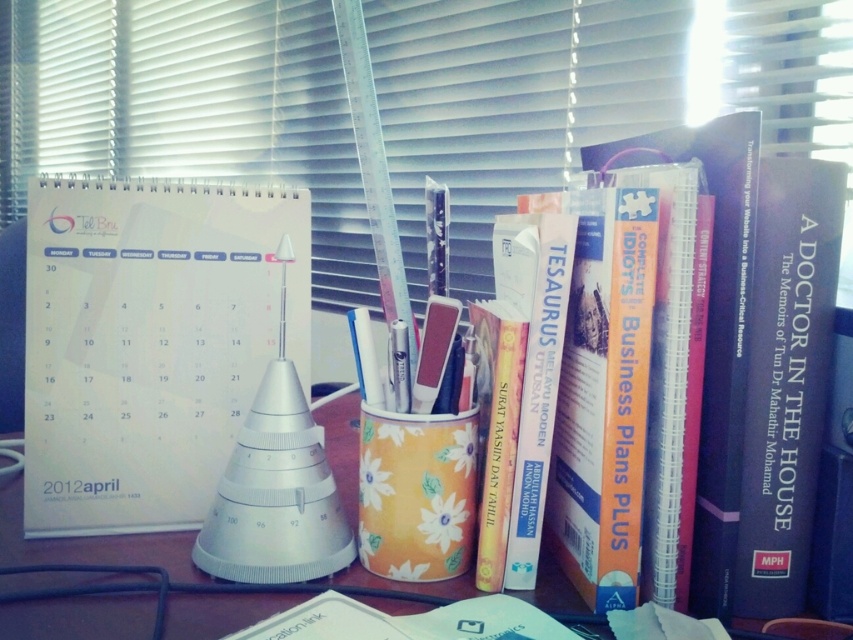
You are organizing your desk and need to place a new item between the white plastic ruler at upper center and the blue hardcover book at right. What is the minimum distance you should maintain between them to ensure the new item fits comfortably?

The white plastic ruler at upper center is 4.54 feet from the blue hardcover book at right. To fit a new item between them comfortably, the minimum distance should be at least 4.54 feet, ensuring there is enough space for the item without overcrowding.

Consider the image. You are organizing your desk and need to place a new item between the white paper calendar at center and the blue hardcover book at right. Based on their positions, where should you place the new item?

The white paper calendar at center is located above the blue hardcover book at right, so you should place the new item between them either below the calendar or above the book.

You are organizing your desk and need to place both the white paper calendar at center and the blue hardcover book at right. If you want to arrange them vertically from tallest to shortest, which should be placed first?

The blue hardcover book at right should be placed first because it is taller than the white paper calendar at center.